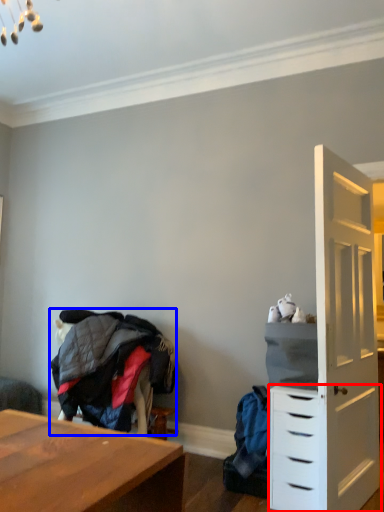
Question: Which of the following is the farthest to the observer, chest of drawers (highlighted by a red box) or clothing (highlighted by a blue box)?

Choices:
 (A) chest of drawers
 (B) clothing

Answer: (B)